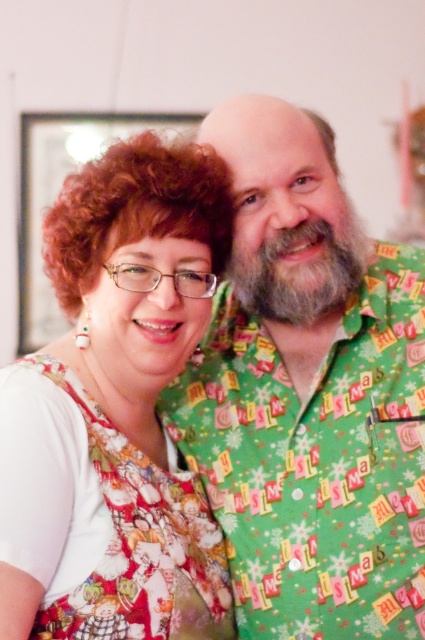
You are a photographer adjusting the lighting for a portrait. You notice the green fabric shirt at center and the white fluffy beard at center. Which object should you adjust the light to highlight first if you want to ensure both are well lit, considering their position?

The green fabric shirt at center is positioned on the left side of white fluffy beard at center, so you should adjust the light to highlight the green fabric shirt at center first to ensure proper illumination across both objects.

Consider the image. You are standing in front of the image and want to touch the two points mentioned. Which point, point (59, 449) or point (266, 289), is closer to you?

Point (59, 449) is closer to the viewer than point (266, 289).

You are a photographer setting up a photo shoot. You need to place a small prop between the green fabric shirt at center and the matte floral dress at left. Based on their heights, which object should the prop be placed closer to?

The green fabric shirt at center is taller than the matte floral dress at left, so the prop should be placed closer to the matte floral dress at left to maintain visual balance.